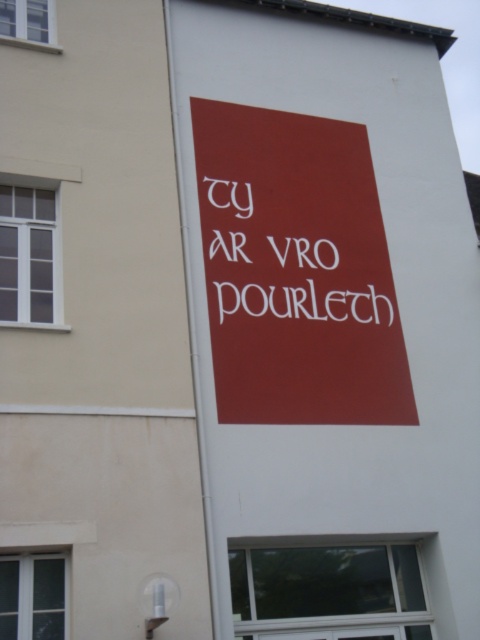
Question: Which of the following is the closest to the observer?

Choices:
 (A) (333, 324)
 (B) (343, 202)

Answer: (A)

Question: Observing the image, what is the correct spatial positioning of matte red sign at center in reference to white matte sign at center?

Choices:
 (A) above
 (B) below

Answer: (B)

Question: Which of the following is the closest to the observer?

Choices:
 (A) matte red sign at center
 (B) white matte sign at center

Answer: (A)

Question: Is matte red sign at center positioned in front of white matte sign at center?

Choices:
 (A) no
 (B) yes

Answer: (B)

Question: Which of the following is the closest to the observer?

Choices:
 (A) white matte sign at center
 (B) matte red sign at center

Answer: (B)

Question: Can you confirm if matte red sign at center is wider than white matte sign at center?

Choices:
 (A) yes
 (B) no

Answer: (A)